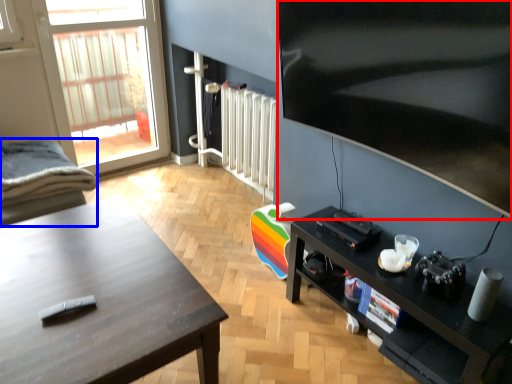
Question: Which object appears closest to the camera in this image, television (highlighted by a red box) or chair (highlighted by a blue box)?

Choices:
 (A) television
 (B) chair

Answer: (A)